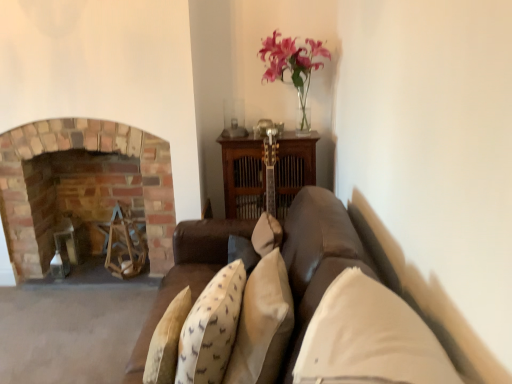
Question: Based on their sizes in the image, would you say white fabric pillow at center, which is the second pillow in left-to-right order, is bigger or smaller than brick fireplace at left?

Choices:
 (A) big
 (B) small

Answer: (B)

Question: Is point (350, 357) positioned closer to the camera than point (86, 119)?

Choices:
 (A) closer
 (B) farther

Answer: (A)

Question: Estimate the real-world distances between objects in this image. Which object is farther from the brick fireplace at left?

Choices:
 (A) beige fabric pillow at center, placed as the 1th pillow when sorted from left to right
 (B) white fabric pillow at center, which ranks as the first pillow in right-to-left order

Answer: (B)

Question: Considering the real-world distances, which object is closest to the beige fabric pillow at center, the 2th pillow from the right?

Choices:
 (A) white fabric pillow at center, which ranks as the first pillow in right-to-left order
 (B) brick fireplace at left

Answer: (A)